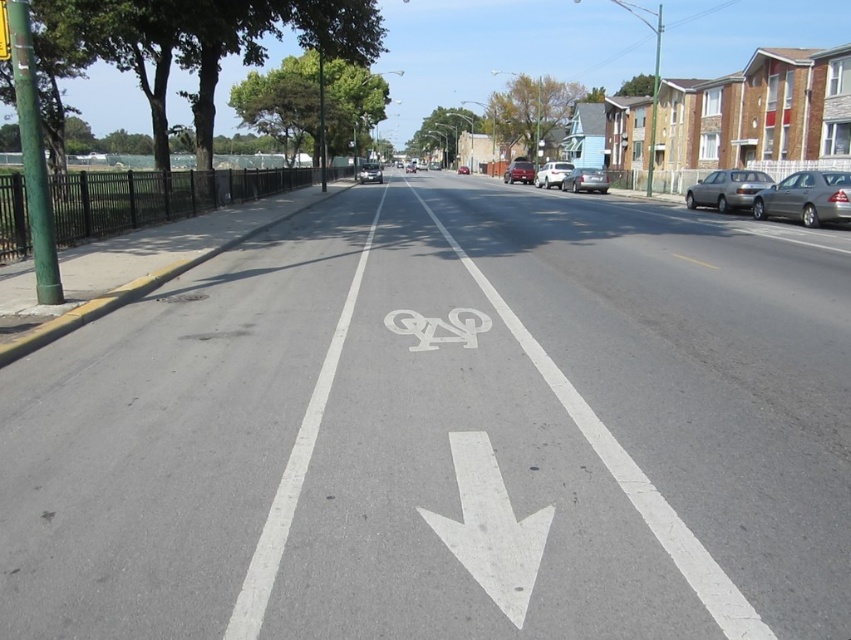
Question: Is white asphalt bike lane at center wider than shiny silver sedan at center?

Choices:
 (A) no
 (B) yes

Answer: (B)

Question: Observing the image, what is the correct spatial positioning of green painted pole at left in reference to shiny silver sedan at center?

Choices:
 (A) below
 (B) above

Answer: (A)

Question: Which of the following is the farthest from the observer?

Choices:
 (A) (510, 177)
 (B) (381, 170)
 (C) (21, 76)
 (D) (501, 508)

Answer: (B)

Question: Considering the relative positions of green painted pole at left and satin black car at center in the image provided, where is green painted pole at left located with respect to satin black car at center?

Choices:
 (A) above
 (B) below

Answer: (B)

Question: Which point is farther from the camera taking this photo?

Choices:
 (A) [368, 179]
 (B) [570, 180]
 (C) [271, 528]

Answer: (A)

Question: Estimate the real-world distances between objects in this image. Which object is farther from the satin silver sedan at center?

Choices:
 (A) metallic red car at center
 (B) white asphalt bike lane at center
 (C) metallic gray sedan at right

Answer: (A)